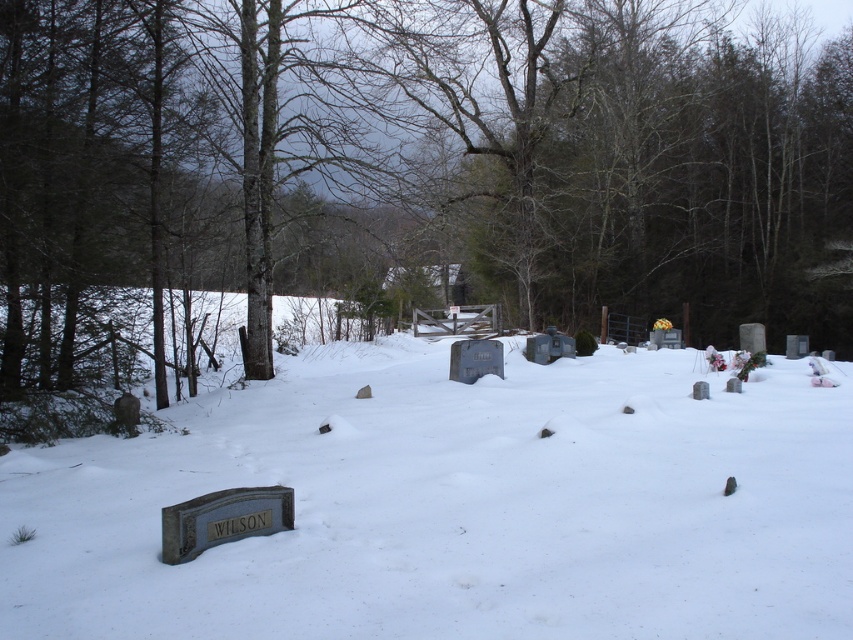
Question: Which point is farther from the camera taking this photo?

Choices:
 (A) (281, 76)
 (B) (328, 564)

Answer: (A)

Question: Is brown bark tree at center thinner than white matte snow at lower left?

Choices:
 (A) yes
 (B) no

Answer: (B)

Question: Is brown bark tree at center to the right of white matte snow at lower left from the viewer's perspective?

Choices:
 (A) yes
 (B) no

Answer: (A)

Question: Which object appears farthest from the camera in this image?

Choices:
 (A) brown bark tree at center
 (B) white matte snow at lower left

Answer: (A)

Question: Is the position of brown bark tree at center more distant than that of white matte snow at lower left?

Choices:
 (A) yes
 (B) no

Answer: (A)